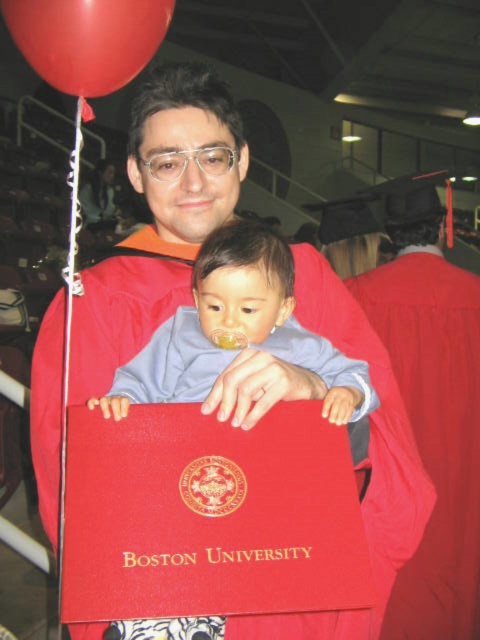
Question: Observing the image, what is the correct spatial positioning of red matte graduation gown at center in reference to rubber balloon at upper left?

Choices:
 (A) below
 (B) above

Answer: (A)

Question: Among these objects, which one is nearest to the camera?

Choices:
 (A) rubber balloon at upper left
 (B) smooth blue shirt at center
 (C) red matte graduation gown at center

Answer: (A)

Question: Can you confirm if red matte graduation gown at center is positioned to the left of smooth blue shirt at center?

Choices:
 (A) yes
 (B) no

Answer: (B)

Question: Does red matte graduation gown at center have a larger size compared to smooth blue shirt at center?

Choices:
 (A) yes
 (B) no

Answer: (A)

Question: Which of the following is the closest to the observer?

Choices:
 (A) red matte graduation gown at center
 (B) rubber balloon at upper left
 (C) smooth blue shirt at center

Answer: (B)

Question: Which object is closer to the camera taking this photo?

Choices:
 (A) rubber balloon at upper left
 (B) smooth blue shirt at center
 (C) red matte graduation gown at center

Answer: (A)